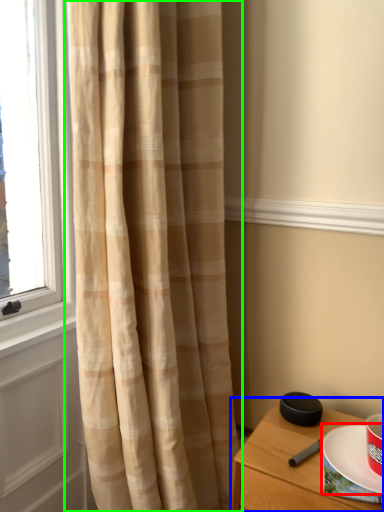
Question: Which object is the farthest from paper plate (highlighted by a red box)? Choose among these: nightstand (highlighted by a blue box) or curtain (highlighted by a green box).

Choices:
 (A) nightstand
 (B) curtain

Answer: (B)